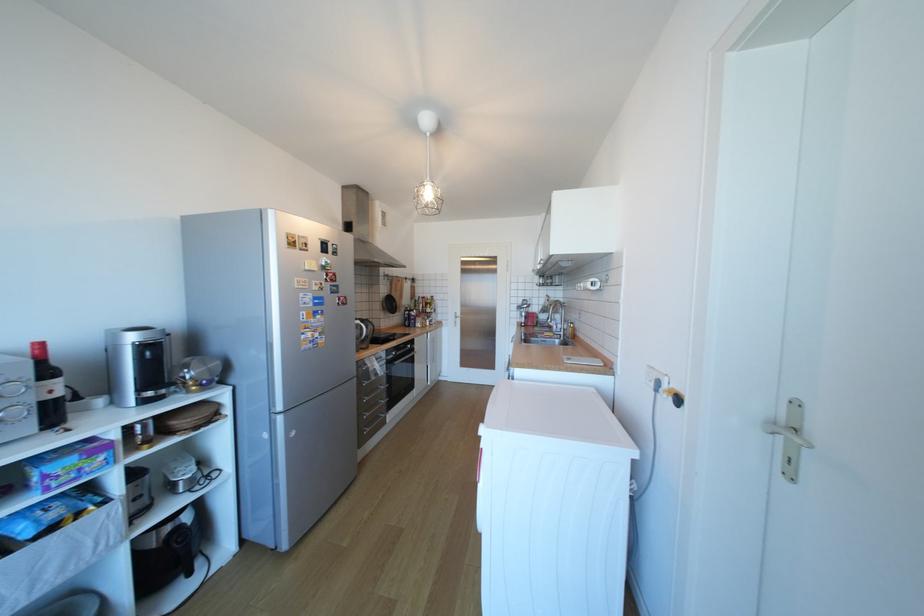
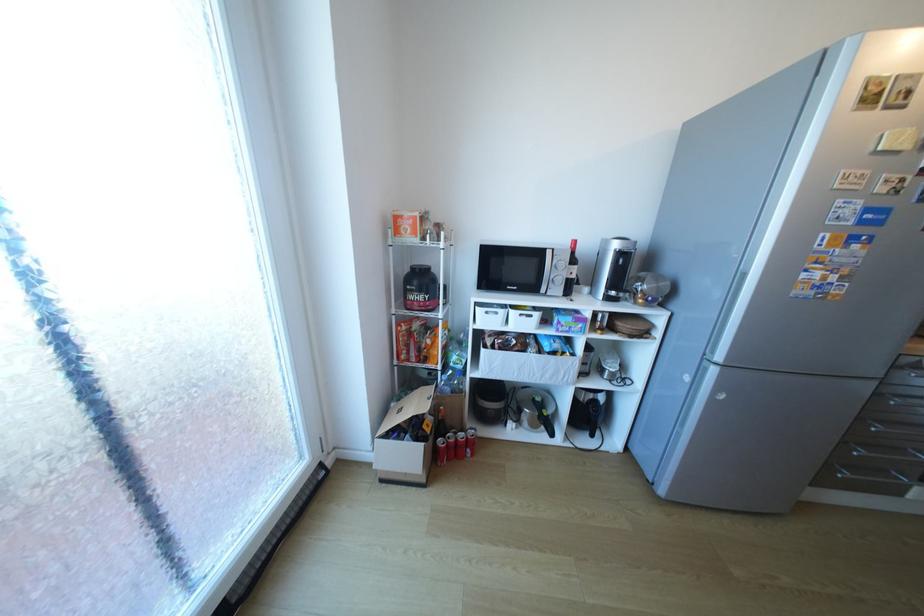
How did the camera likely rotate?

The camera's rotation is toward left-down.